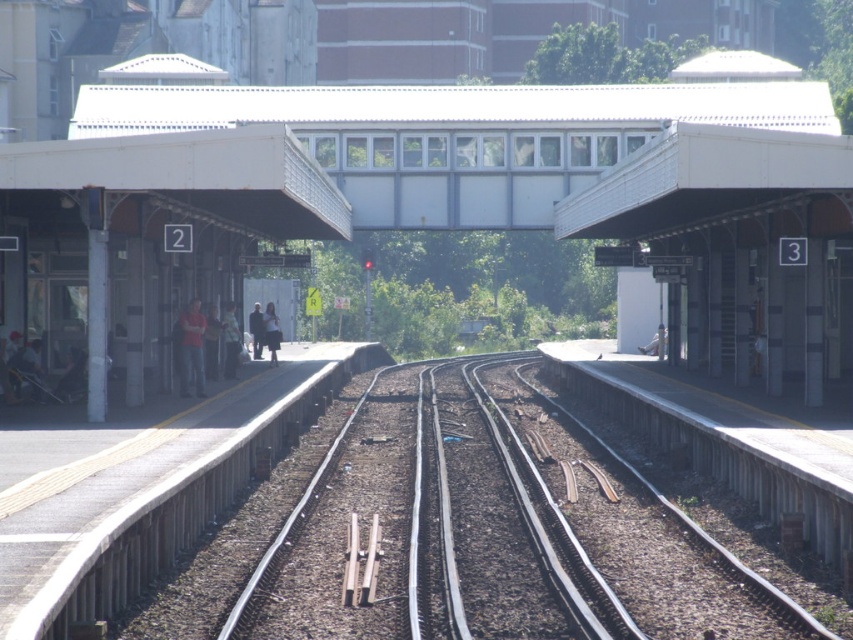
You are a maintenance worker tasked with inspecting the smooth concrete train track at center. Based on the coordinates provided in the Objects Description, can you determine the exact position of the track relative to the platforms?

The smooth concrete train track at center is located at coordinates point (x=570, y=524), which places it centrally between the two platforms as per the given coordinates.